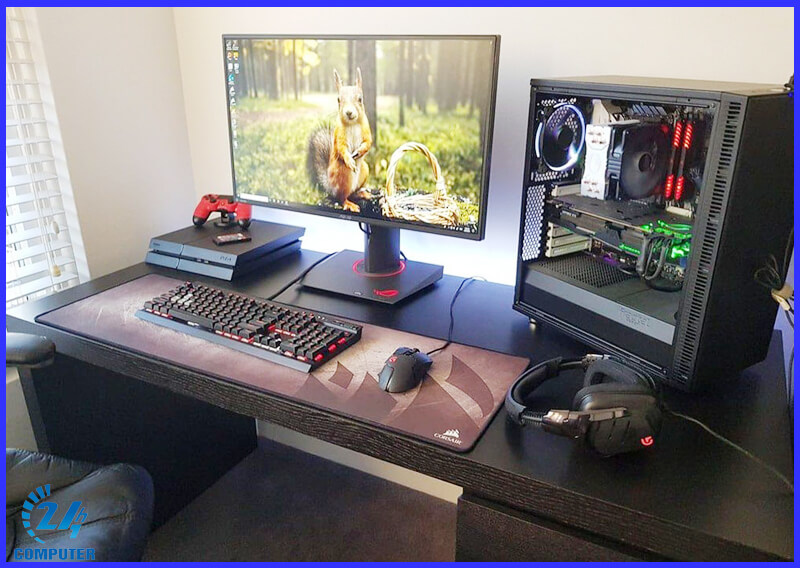
Find the location of `blinds`. blinds is located at coordinates (30, 218).